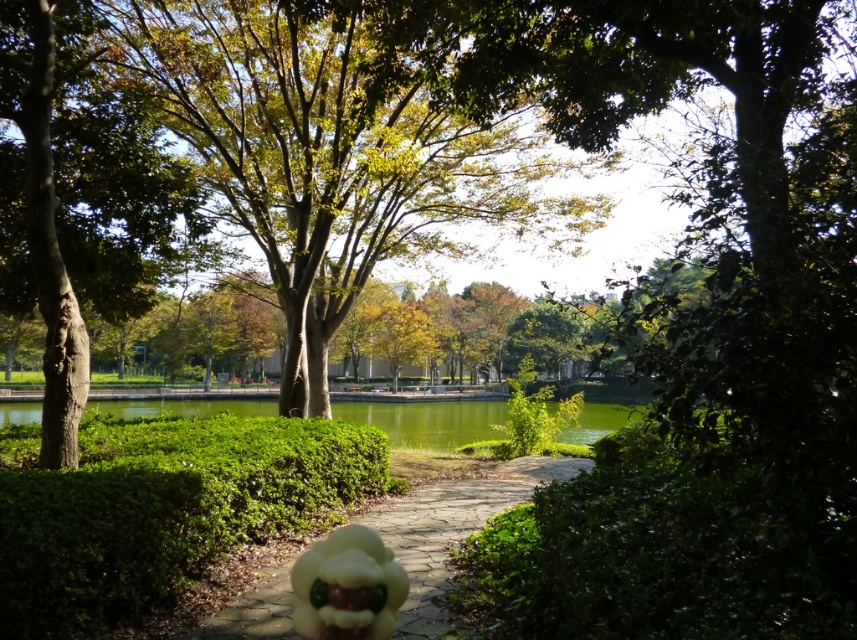
Does green matte tree at left lie behind yellow matte plush at center?

Yes, green matte tree at left is behind yellow matte plush at center.

Can you confirm if green matte tree at left is taller than yellow matte plush at center?

Yes.

Which is behind, point (39, 115) or point (345, 532)?

Positioned behind is point (39, 115).

Where is `green matte tree at left`? This screenshot has height=640, width=857. green matte tree at left is located at coordinates (75, 198).

Consider the image. Can you confirm if green leafy hedge at center is positioned to the left of yellow matte plush at center?

Indeed, green leafy hedge at center is positioned on the left side of yellow matte plush at center.

Which is behind, point (337, 497) or point (319, 627)?

The point (337, 497) is behind.

The height and width of the screenshot is (640, 857). Identify the location of green leafy hedge at center. point(160,508).

How far apart are green matte tree at left and yellow rubber duck at center?

green matte tree at left is 15.54 feet away from yellow rubber duck at center.

Is green matte tree at left bigger than yellow rubber duck at center?

Yes, green matte tree at left is bigger than yellow rubber duck at center.

The height and width of the screenshot is (640, 857). Identify the location of green matte tree at left. (75, 198).